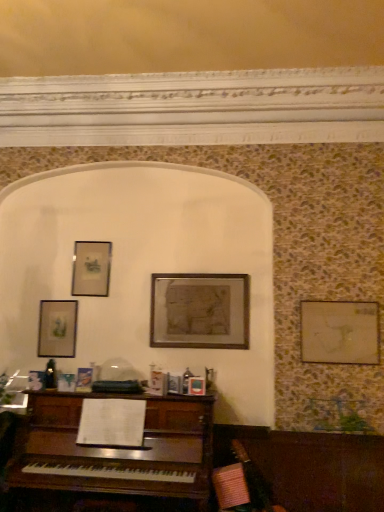
The image size is (384, 512). Find the location of `empty space that is ontop of wooden framed map at center, which is counted as the 3th picture frame, starting from the left (from a real-world perspective)`. empty space that is ontop of wooden framed map at center, which is counted as the 3th picture frame, starting from the left (from a real-world perspective) is located at coordinates (208, 269).